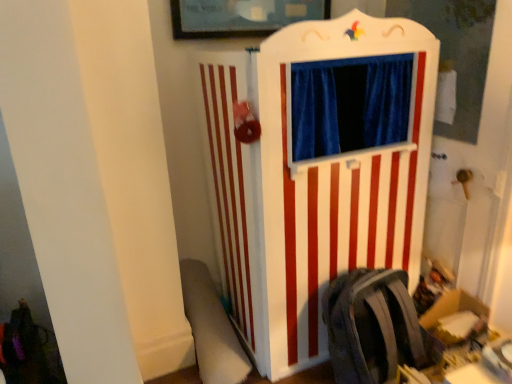
Question: From a real-world perspective, is white wood puppet theater at center physically located above or below white plush swivel chair at lower left?

Choices:
 (A) above
 (B) below

Answer: (A)

Question: From the image's perspective, is white wood puppet theater at center located above or below white plush swivel chair at lower left?

Choices:
 (A) above
 (B) below

Answer: (A)

Question: Estimate the real-world distances between objects in this image. Which object is closer to the matte gray backpack at lower right?

Choices:
 (A) white wood puppet theater at center
 (B) white plush swivel chair at lower left

Answer: (A)

Question: Estimate the real-world distances between objects in this image. Which object is farther from the white plush swivel chair at lower left?

Choices:
 (A) matte gray backpack at lower right
 (B) white wood puppet theater at center

Answer: (A)